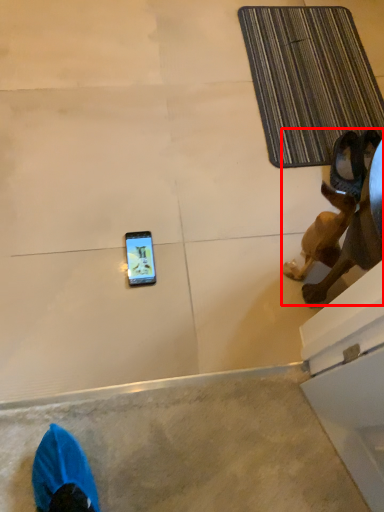
Question: From the image, what is the correct spatial relationship of animal (annotated by the red box) in relation to bath mat?

Choices:
 (A) right
 (B) left

Answer: (A)